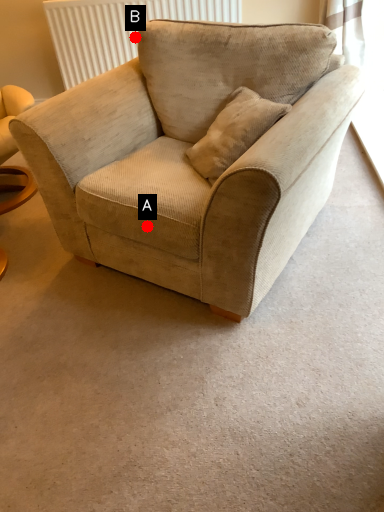
Question: Two points are circled on the image, labeled by A and B beside each circle. Which point is closer to the camera?

Choices:
 (A) A is closer
 (B) B is closer

Answer: (A)